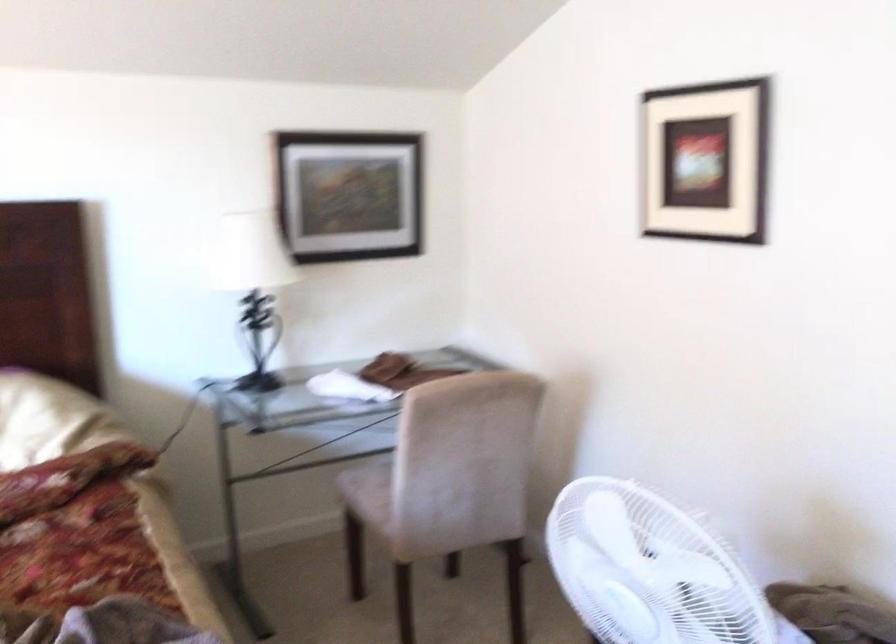
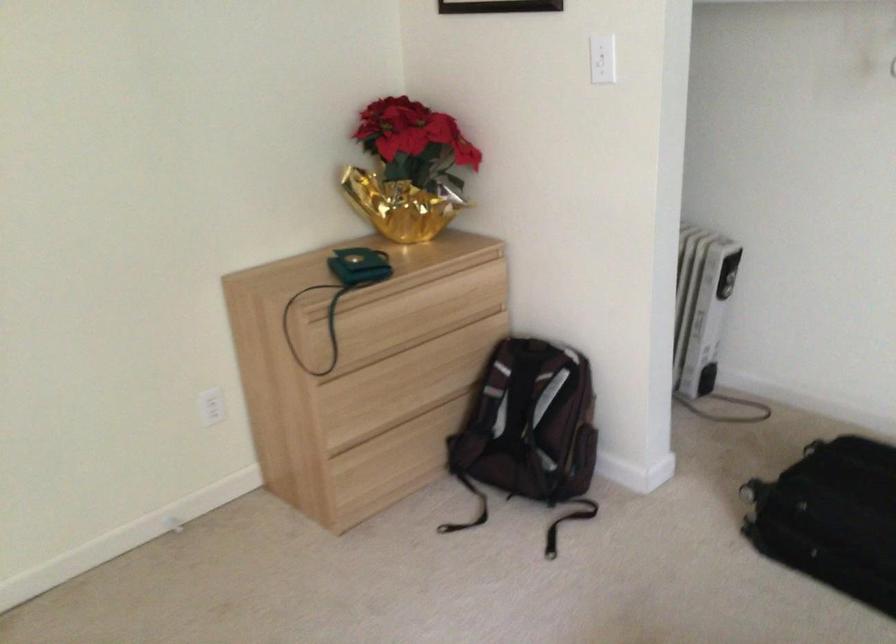
First-person continuous shooting, in which direction is the camera rotating?

The camera's rotation is toward right-down.